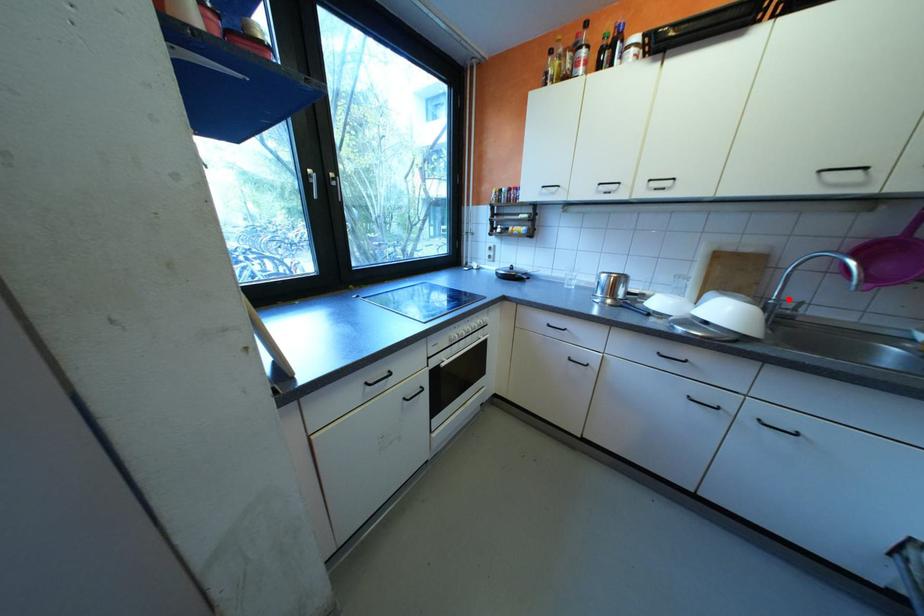
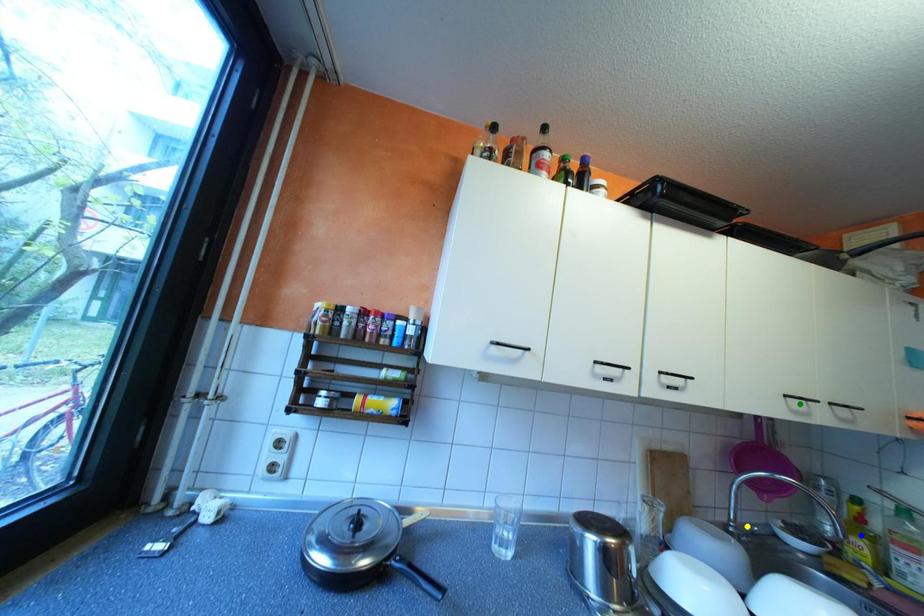
Question: I am providing you with two images of the same scene from different viewpoints. A red point is marked on the first image. You are given multiple points on the second image. Which point in image 2 is actually the same real-world point as the red point in image 1?

Choices:
 (A) green point
 (B) yellow point
 (C) blue point

Answer: (B)